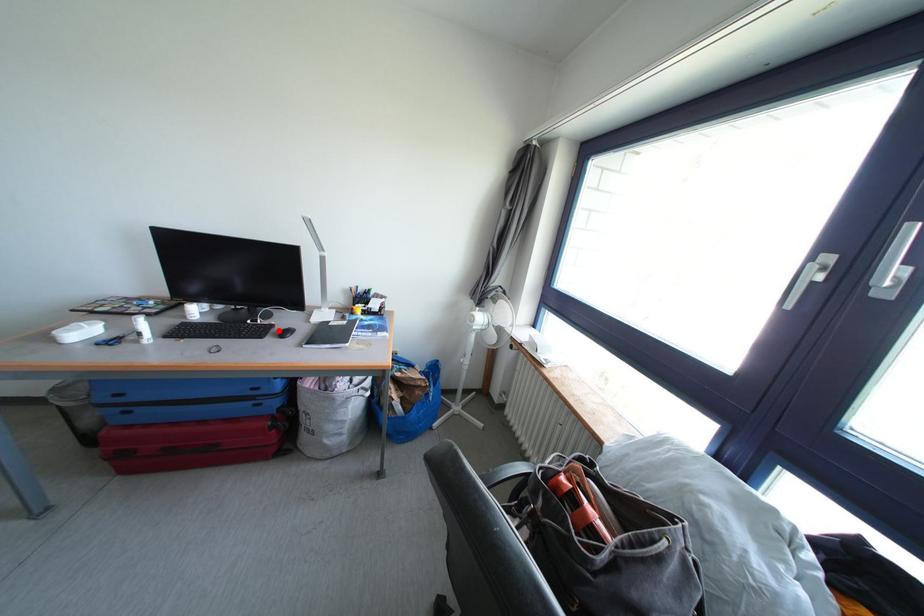
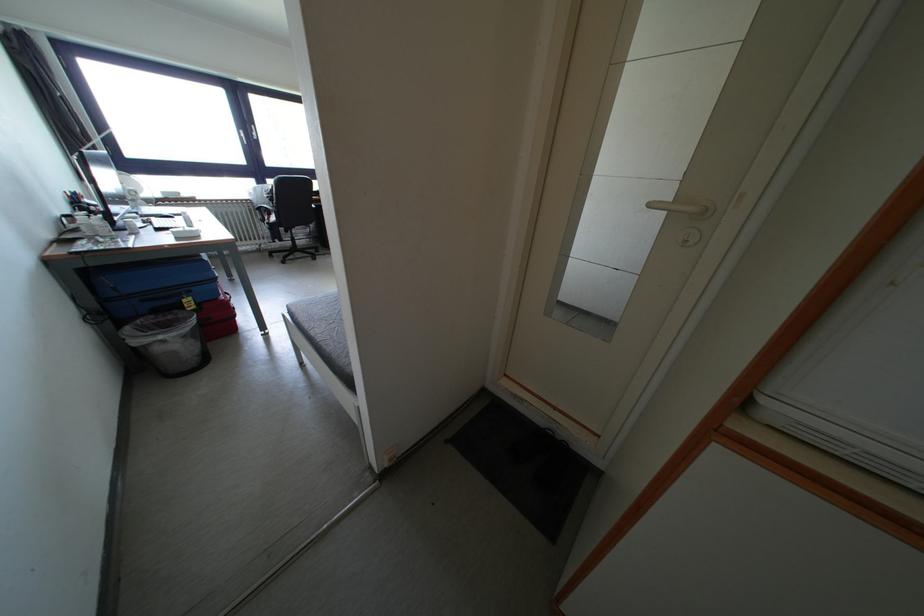
Question: I am providing you with two images of the same scene from different viewpoints. A red point is marked on the first image. Can you still see the location of the red point in image 2?

Choices:
 (A) Yes
 (B) No

Answer: (B)